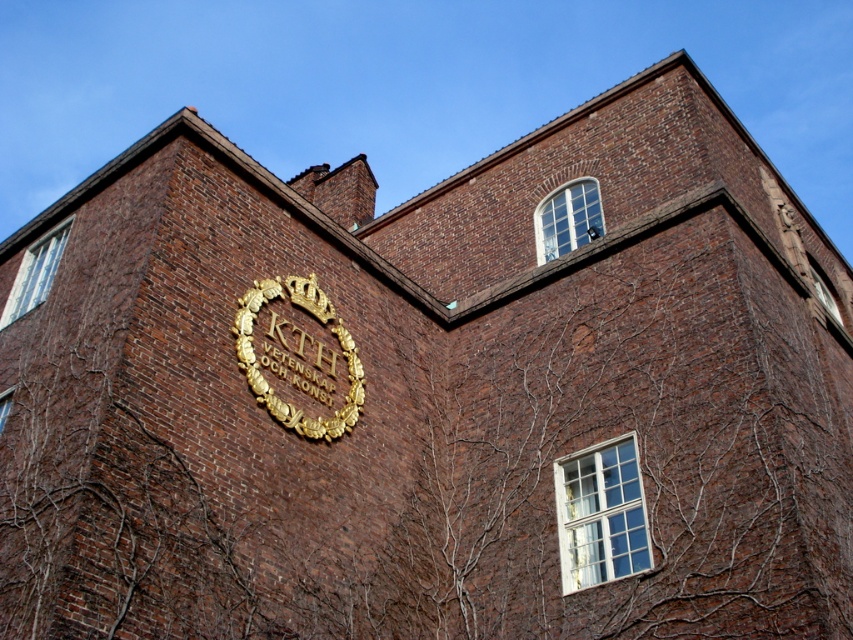
Does point (633, 536) come in front of point (573, 202)?

Yes, point (633, 536) is in front of point (573, 202).

Between white glass window at center and clear glass window at upper center, which one has more height?

Standing taller between the two is white glass window at center.

Between point (614, 464) and point (601, 216), which one is positioned in front?

Point (614, 464) is in front.

Where is `white glass window at center`? This screenshot has width=853, height=640. white glass window at center is located at coordinates [x=601, y=513].

Is clear glass window at upper center positioned in front of white glass window at upper left?

No, clear glass window at upper center is behind white glass window at upper left.

Is point (572, 192) positioned behind point (35, 301)?

That is True.

In order to click on clear glass window at upper center in this screenshot , I will do `click(567, 220)`.

Can you confirm if goldmaterial/texturekth emblem at center is taller than white glass window at upper left?

Correct, goldmaterial/texturekth emblem at center is much taller as white glass window at upper left.

Does goldmaterial/texturekth emblem at center appear over white glass window at upper left?

Incorrect, goldmaterial/texturekth emblem at center is not positioned above white glass window at upper left.

Is point (248, 356) closer to viewer compared to point (65, 234)?

Yes, point (248, 356) is closer to viewer.

Image resolution: width=853 pixels, height=640 pixels. I want to click on goldmaterial/texturekth emblem at center, so click(299, 356).